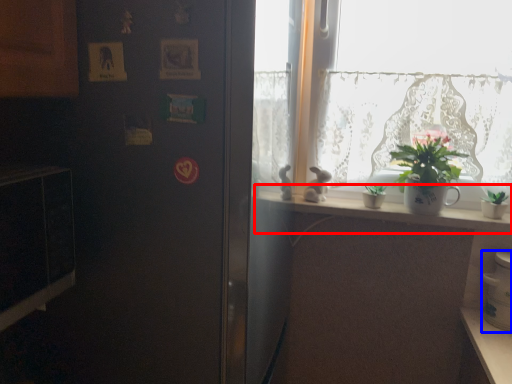
Question: Which object is further to the camera taking this photo, window sill (highlighted by a red box) or appliance (highlighted by a blue box)?

Choices:
 (A) window sill
 (B) appliance

Answer: (A)